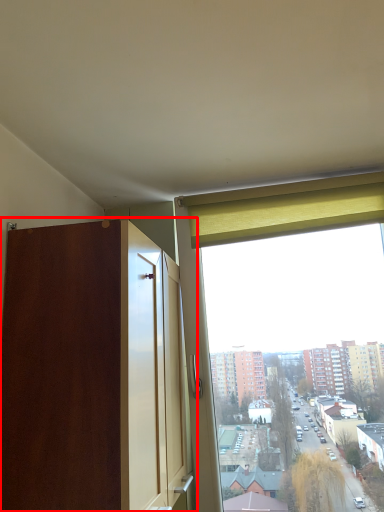
Question: In this image, where is dresser (annotated by the red box) located relative to curtain?

Choices:
 (A) right
 (B) left

Answer: (B)